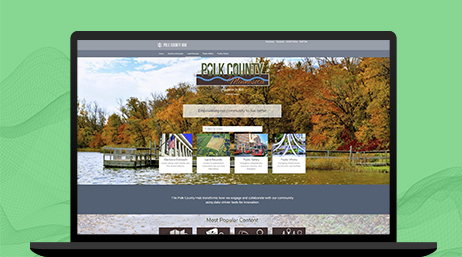
The height and width of the screenshot is (257, 462). I want to click on flat screen computer, so pyautogui.click(x=239, y=34).